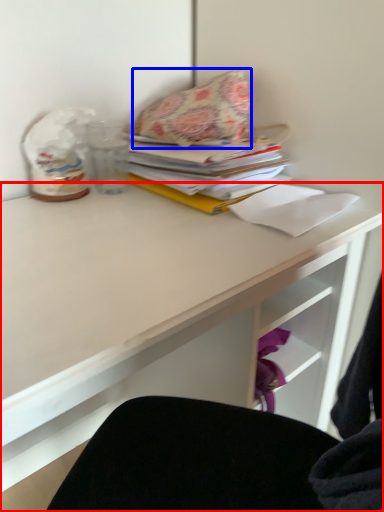
Question: Which object is closer to the camera taking this photo, desk (highlighted by a red box) or throw pillow (highlighted by a blue box)?

Choices:
 (A) desk
 (B) throw pillow

Answer: (A)